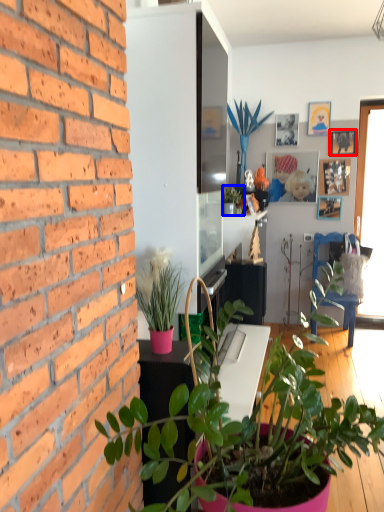
Question: Which object is closer to the camera taking this photo, picture frame (highlighted by a red box) or houseplant (highlighted by a blue box)?

Choices:
 (A) picture frame
 (B) houseplant

Answer: (B)